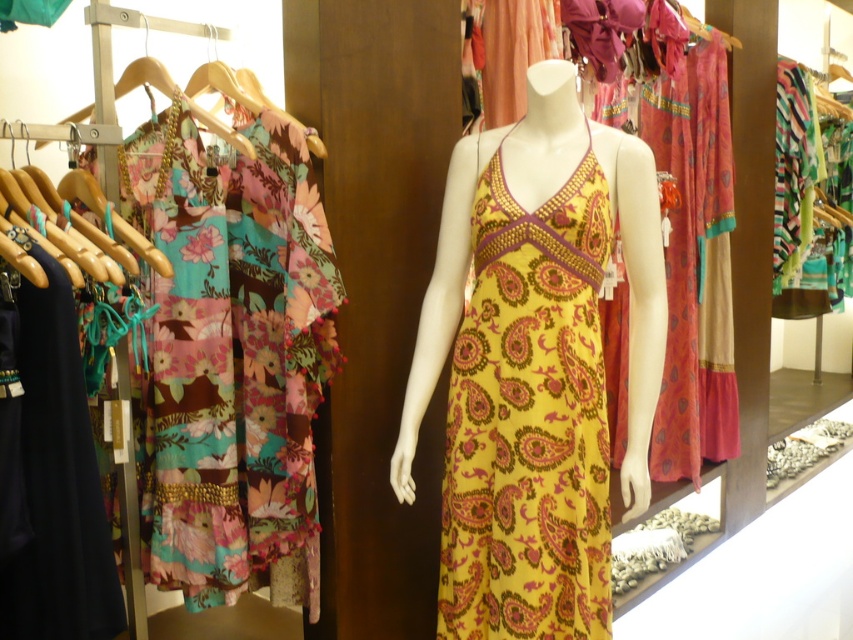
You are a customer in a clothing store and want to find the yellow paisley fabric dress at center and the wooden hanger at upper left. According to the store layout, which one is positioned to the right side?

The yellow paisley fabric dress at center is positioned to the right of the wooden hanger at upper left.

You are a customer in the store and want to take the yellow paisley fabric dress at center to try on. Do you need to move the wooden hanger at upper left first?

The yellow paisley fabric dress at center is positioned under the wooden hanger at upper left, so you would need to move the wooden hanger at upper left first to access the dress.